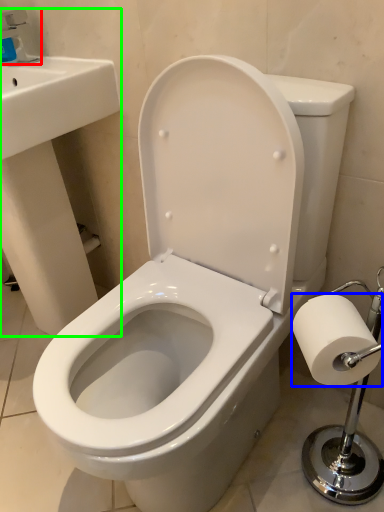
Question: Considering the real-world distances, which object is farthest from faucet (highlighted by a red box)? toilet paper (highlighted by a blue box) or sink (highlighted by a green box)?

Choices:
 (A) toilet paper
 (B) sink

Answer: (A)